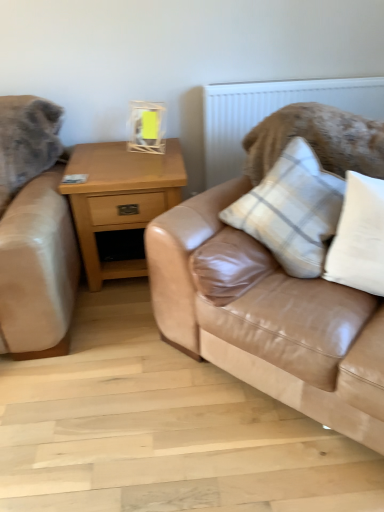
Question: Is matte yellow glass at upper center not inside plaid fabric pillow at center, arranged as the second pillow when viewed from the right?

Choices:
 (A) yes
 (B) no

Answer: (A)

Question: From the image's perspective, is matte yellow glass at upper center below plaid fabric pillow at center, arranged as the second pillow when viewed from the right?

Choices:
 (A) yes
 (B) no

Answer: (B)

Question: Is matte yellow glass at upper center far away from plaid fabric pillow at center, which is counted as the 1th pillow, starting from the left?

Choices:
 (A) no
 (B) yes

Answer: (A)

Question: From a real-world perspective, is matte yellow glass at upper center positioned under plaid fabric pillow at center, arranged as the second pillow when viewed from the right, based on gravity?

Choices:
 (A) yes
 (B) no

Answer: (B)

Question: Is plaid fabric pillow at center, arranged as the second pillow when viewed from the right, inside matte yellow glass at upper center?

Choices:
 (A) yes
 (B) no

Answer: (B)

Question: Does matte yellow glass at upper center have a smaller size compared to plaid fabric pillow at center, which is counted as the 1th pillow, starting from the left?

Choices:
 (A) yes
 (B) no

Answer: (A)

Question: Is light brown wood nightstand at center placed right next to white cotton pillow at upper right, arranged as the 2th pillow when viewed from the left?

Choices:
 (A) yes
 (B) no

Answer: (B)

Question: Is white cotton pillow at upper right, which is the 1th pillow from right to left, completely or partially inside light brown wood nightstand at center?

Choices:
 (A) no
 (B) yes

Answer: (A)

Question: Is there a large distance between light brown wood nightstand at center and white cotton pillow at upper right, which is the 1th pillow from right to left?

Choices:
 (A) yes
 (B) no

Answer: (B)

Question: Is light brown wood nightstand at center wider than white cotton pillow at upper right, which is the 1th pillow from right to left?

Choices:
 (A) yes
 (B) no

Answer: (A)

Question: Can you confirm if light brown wood nightstand at center is taller than white cotton pillow at upper right, arranged as the 2th pillow when viewed from the left?

Choices:
 (A) no
 (B) yes

Answer: (B)

Question: From the image's perspective, is light brown wood nightstand at center below white cotton pillow at upper right, which is the 1th pillow from right to left?

Choices:
 (A) yes
 (B) no

Answer: (B)

Question: Could white textured radiator at upper center be considered to be inside plaid fabric pillow at center, which is counted as the 1th pillow, starting from the left?

Choices:
 (A) yes
 (B) no

Answer: (B)